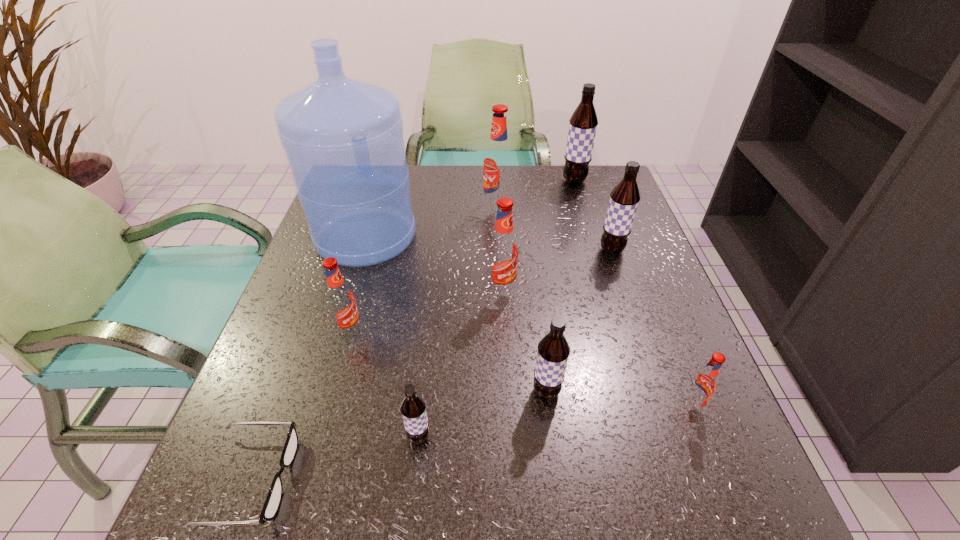
Locate an element on the screen. the leftmost red root beer is located at coordinates (340, 299).

What are the coordinates of `the leftmost root beer` in the screenshot? It's located at (340, 299).

Where is `the second smallest brown root beer`? The width and height of the screenshot is (960, 540). the second smallest brown root beer is located at coordinates (553, 350).

Locate an element on the screen. The image size is (960, 540). the third farthest brown root beer is located at coordinates (553, 350).

At what (x,y) coordinates should I click in order to perform the action: click on the rightmost red root beer. Please return your answer as a coordinate pair (x, y). Looking at the image, I should click on (703, 384).

Where is `the smallest red root beer`? the smallest red root beer is located at coordinates (703, 384).

Find the location of `the smallest brown root beer`. the smallest brown root beer is located at coordinates (413, 407).

Find the location of a particular element. This screenshot has height=540, width=960. the nearest root beer is located at coordinates (413, 407).

This screenshot has width=960, height=540. I want to click on spectacles, so click(x=273, y=500).

The image size is (960, 540). Find the location of `the shortest object`. the shortest object is located at coordinates (273, 500).